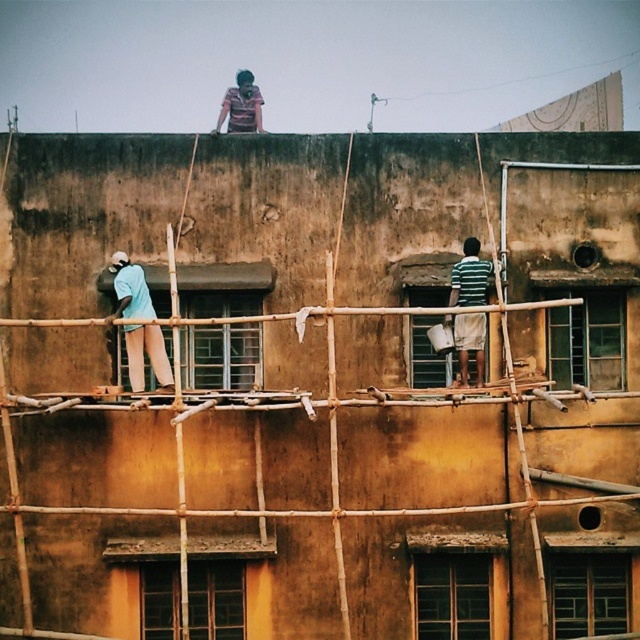
Question: Does light blue fabric at left appear over striped cotton shirt at center?

Choices:
 (A) yes
 (B) no

Answer: (B)

Question: Which point appears closest to the camera in this image?

Choices:
 (A) [461, 288]
 (B) [138, 378]
 (C) [212, 131]

Answer: (A)

Question: Which point appears farthest from the camera in this image?

Choices:
 (A) (230, 106)
 (B) (129, 353)

Answer: (A)

Question: Is striped cotton shirt at center positioned behind striped fabric shirt at upper center?

Choices:
 (A) yes
 (B) no

Answer: (B)

Question: Considering the real-world distances, which object is closest to the light blue fabric at left?

Choices:
 (A) striped cotton shirt at center
 (B) striped fabric shirt at upper center

Answer: (B)

Question: Can you confirm if striped cotton shirt at center is smaller than striped fabric shirt at upper center?

Choices:
 (A) no
 (B) yes

Answer: (B)